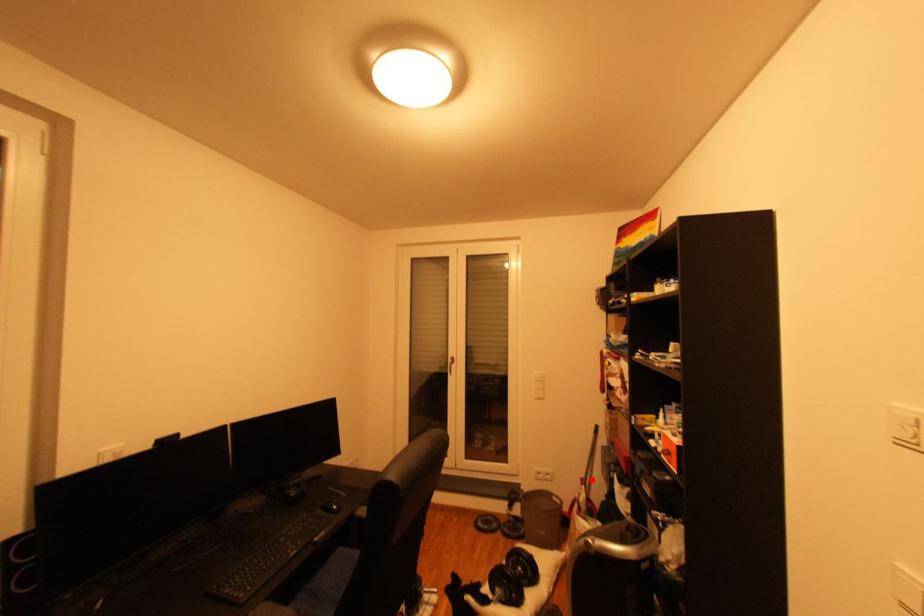
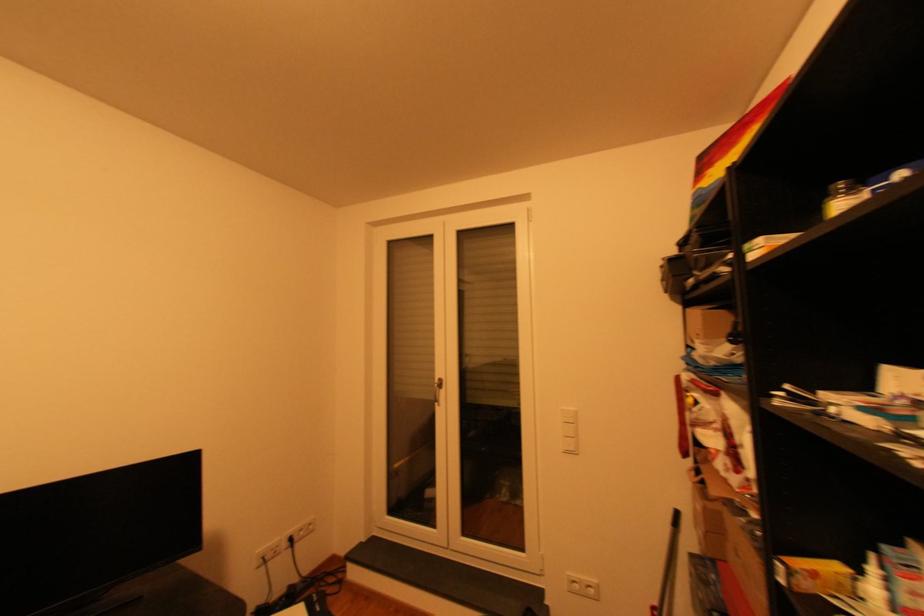
The point at the highlighted location is marked in the first image. Where is the corresponding point in the second image?

(662, 608)